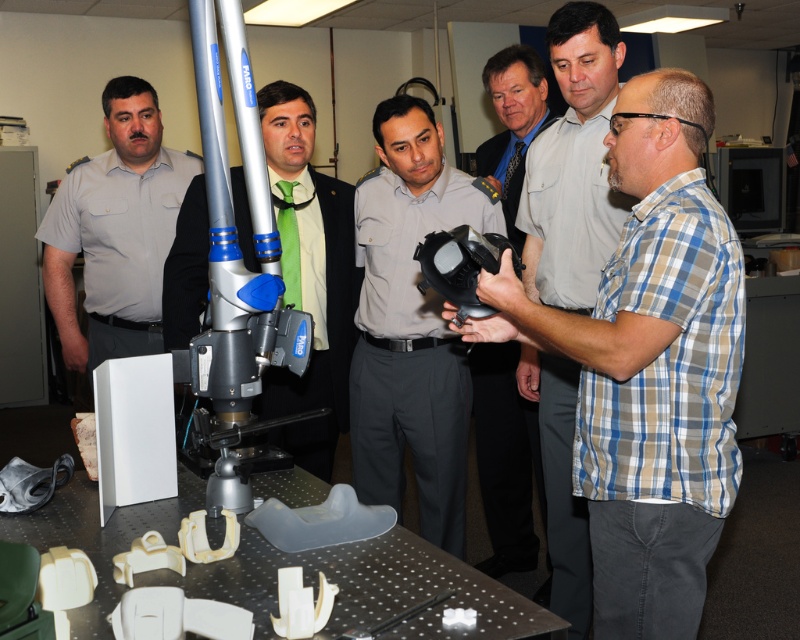
Question: Which of the following is the farthest from the observer?

Choices:
 (A) (370, 300)
 (B) (430, 234)

Answer: (A)

Question: Is plaid cotton shirt at center above matte black helmet at center?

Choices:
 (A) no
 (B) yes

Answer: (A)

Question: Does matte gray helmet at center have a larger size compared to matte black helmet at center?

Choices:
 (A) yes
 (B) no

Answer: (B)

Question: Where is plaid shirt at center located in relation to black matte mask at center in the image?

Choices:
 (A) above
 (B) below

Answer: (B)

Question: Which point is closer to the camera?

Choices:
 (A) matte black helmet at center
 (B) plaid cotton shirt at center
 (C) gray uniform at left
 (D) matte gray helmet at center

Answer: (B)

Question: Which point is closer to the camera taking this photo?

Choices:
 (A) (192, 177)
 (B) (516, 196)
 (C) (169, 275)
 (D) (496, 323)

Answer: (D)